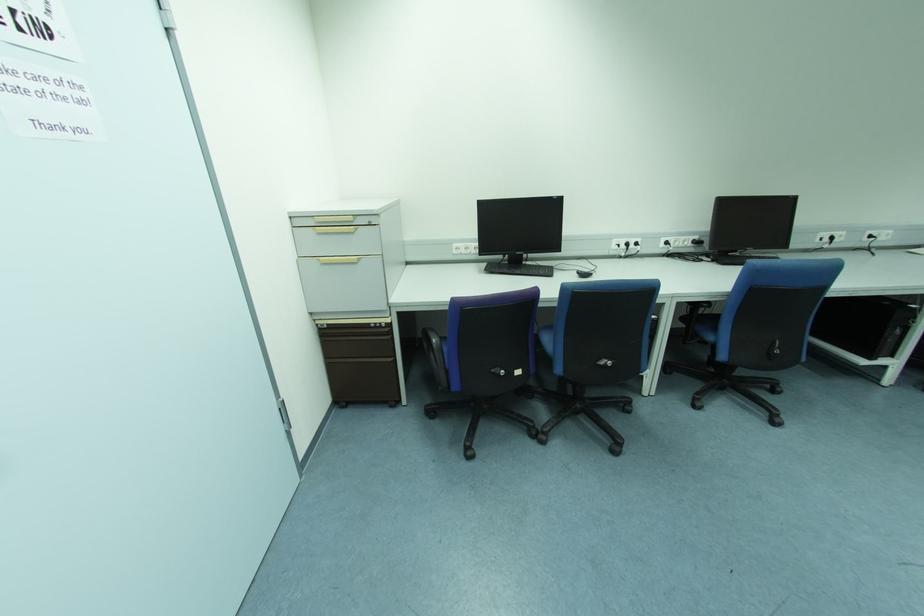
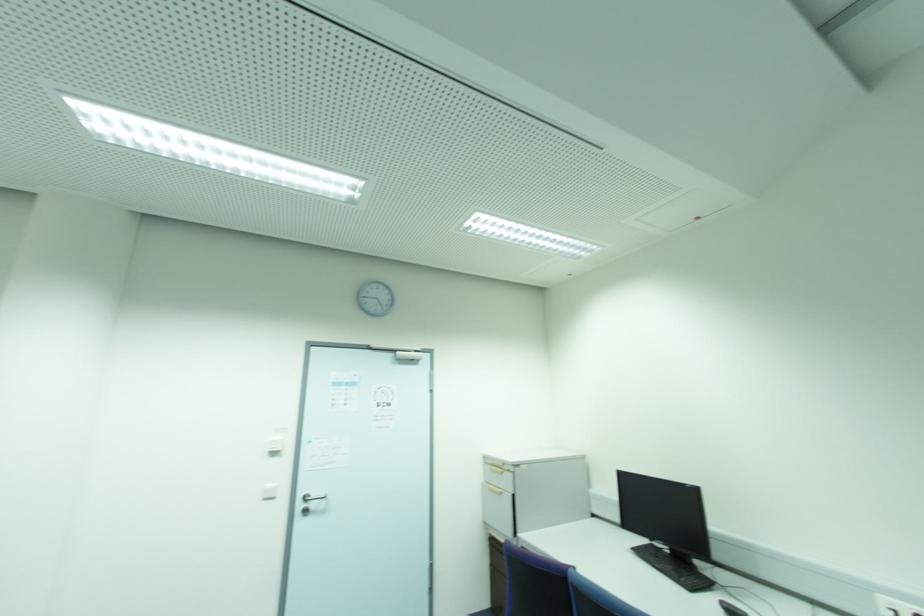
Where in the second image is the point corresponding to (578,276) from the first image?

(723, 610)